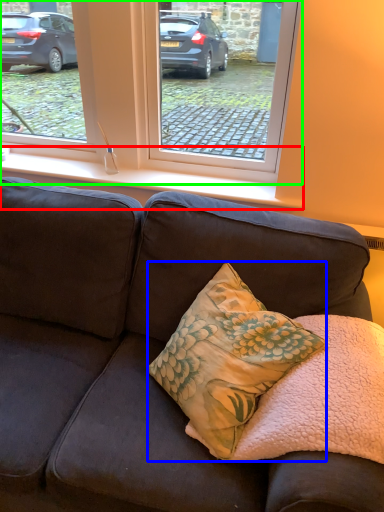
Question: Based on their relative distances, which object is nearer to window sill (highlighted by a red box)? Choose from pillow (highlighted by a blue box) and window (highlighted by a green box).

Choices:
 (A) pillow
 (B) window

Answer: (B)